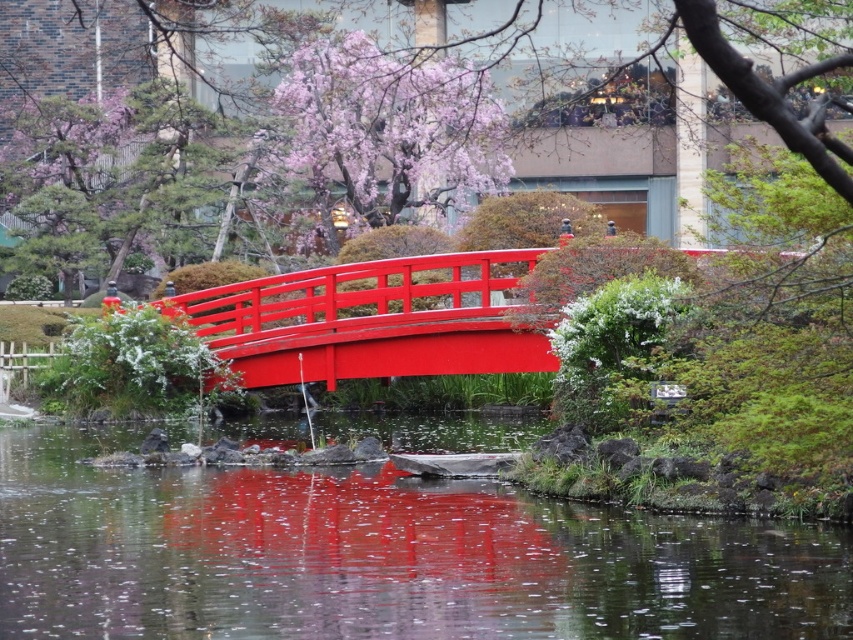
Is transparent water at center to the right of glossy wood bridge at center from the viewer's perspective?

Yes, transparent water at center is to the right of glossy wood bridge at center.

Between transparent water at center and glossy wood bridge at center, which one has more height?

glossy wood bridge at center

Which is in front, point (653, 584) or point (425, 282)?

Point (653, 584) is in front.

This screenshot has width=853, height=640. What are the coordinates of `transparent water at center` in the screenshot? It's located at (379, 556).

Who is more forward, [282,348] or [415,131]?

Point [282,348] is in front.

Between glossy wood bridge at center and pink blossoms at upper center, which one is positioned lower?

glossy wood bridge at center is below.

The width and height of the screenshot is (853, 640). What do you see at coordinates (373, 320) in the screenshot?
I see `glossy wood bridge at center` at bounding box center [373, 320].

This screenshot has width=853, height=640. Identify the location of glossy wood bridge at center. (373, 320).

Which is more to the right, transparent water at center or pink blossoms at upper center?

pink blossoms at upper center

Is point (33, 428) positioned before point (328, 148)?

Yes.

Where is `transparent water at center`? transparent water at center is located at coordinates (379, 556).